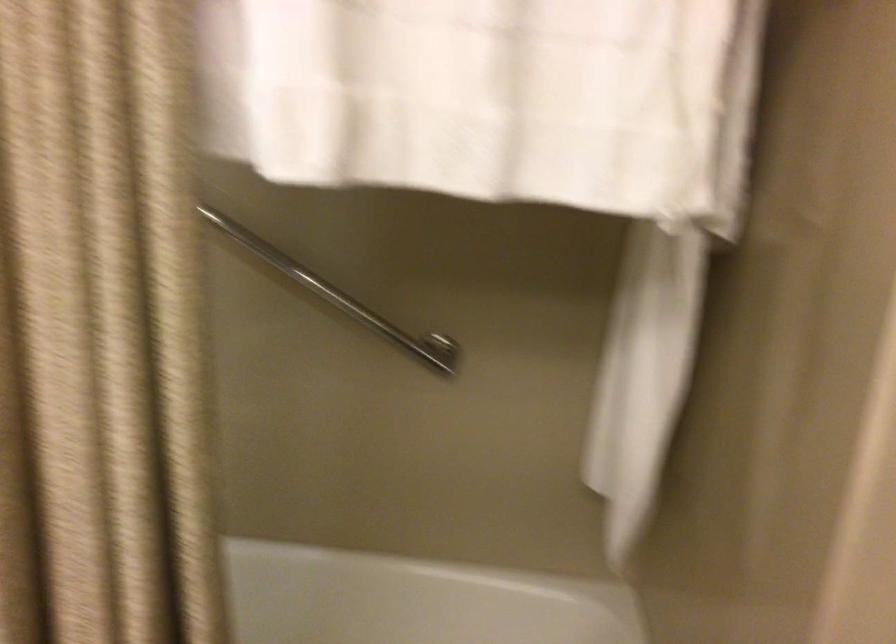
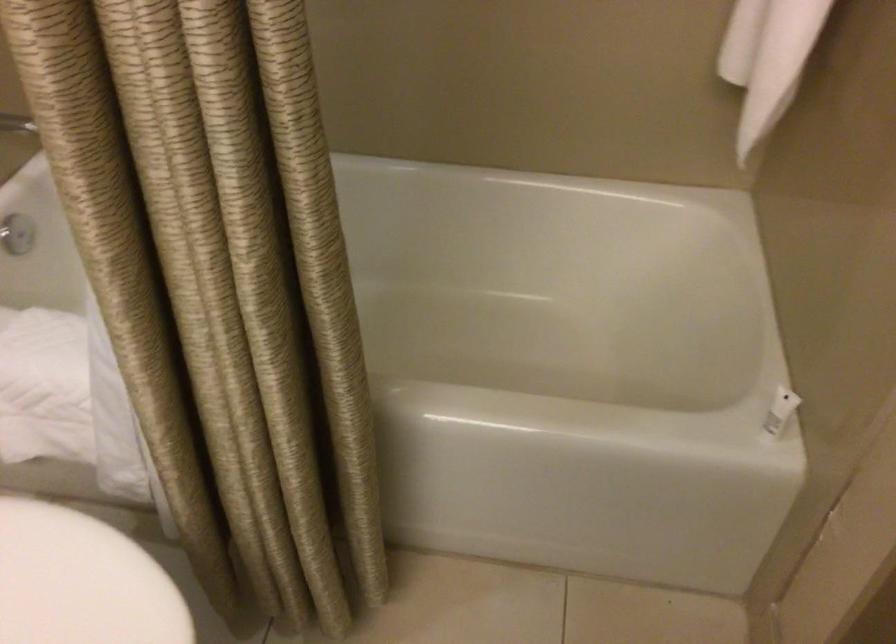
Question: The first image is from the beginning of the video and the second image is from the end. How did the camera likely rotate when shooting the video?

Choices:
 (A) Left
 (B) Right
 (C) Up
 (D) Down

Answer: (D)